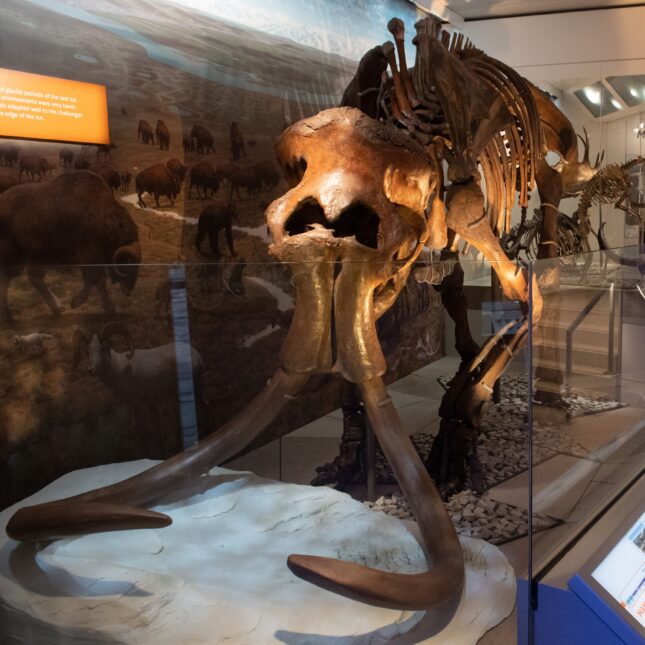
I want to click on screen, so click(610, 577).